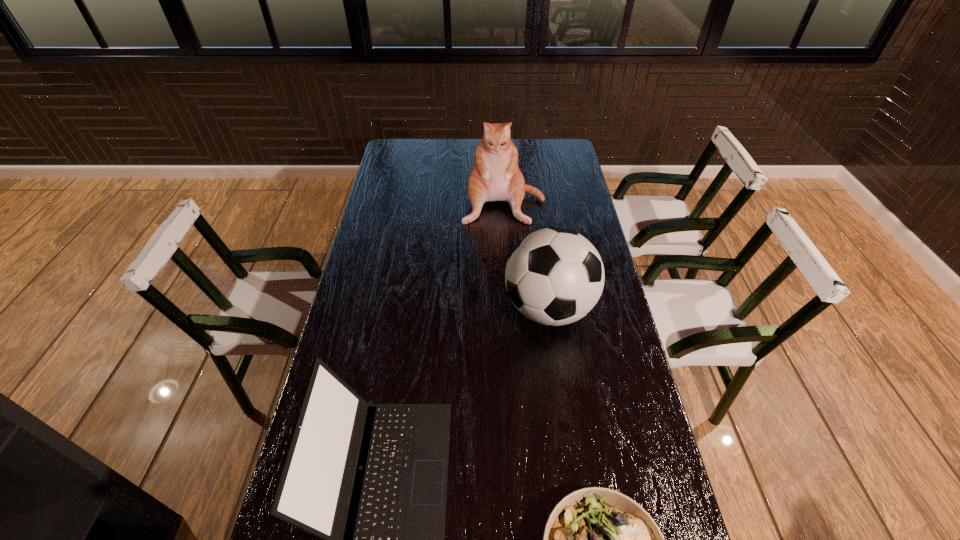
Image resolution: width=960 pixels, height=540 pixels. What are the coordinates of `the farthest object` in the screenshot? It's located at (495, 176).

Identify the location of soccer ball. This screenshot has height=540, width=960. (554, 276).

At what (x,y) coordinates should I click in order to perform the action: click on free space located 0.120m on the face of the cat. Please return your answer as a coordinate pair (x, y). The image size is (960, 540). Looking at the image, I should click on (506, 247).

Identify the location of vacant space located on the left of the soccer ball. The width and height of the screenshot is (960, 540). (424, 308).

Identify the location of object located at the right edge. This screenshot has width=960, height=540. (554, 276).

This screenshot has height=540, width=960. I want to click on free space at the left edge of the desktop, so click(385, 280).

Find the location of a particular element. blank space at the right edge is located at coordinates (574, 196).

Point out which object is positioned as the third nearest to the soccer ball. Please provide its 2D coordinates. Your answer should be formatted as a tuple, i.e. [(x, y)], where the tuple contains the x and y coordinates of a point satisfying the conditions above.

[(596, 539)]

Find the location of a particular element. object that ranks as the second closest to the salad plate is located at coordinates (554, 276).

Locate an element on the screen. This screenshot has width=960, height=540. vacant space that satisfies the following two spatial constraints: 1. on the face of the farthest object; 2. on the left side of the soccer ball is located at coordinates point(510,308).